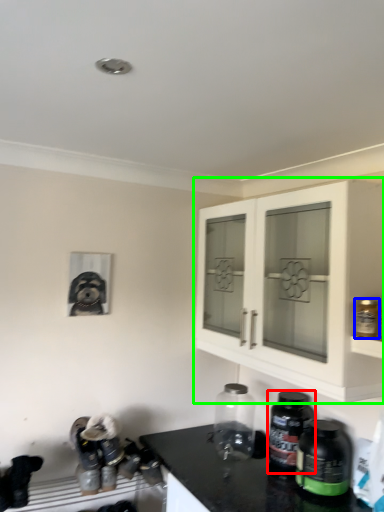
Question: Which object is positioned farthest from bottle (highlighted by a red box)? Select from bottle (highlighted by a blue box) and cabinetry (highlighted by a green box).

Choices:
 (A) bottle
 (B) cabinetry

Answer: (A)